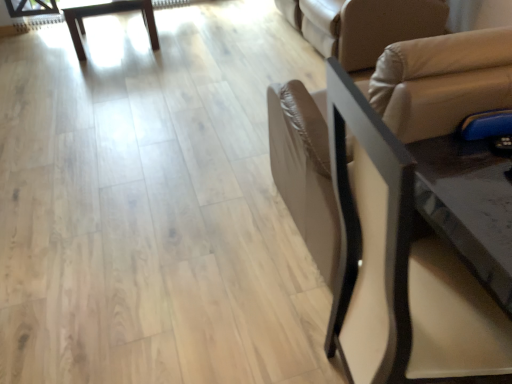
Find the location of a particular element. The height and width of the screenshot is (384, 512). vacant area that is situated to the right of wooden table at upper left is located at coordinates (192, 41).